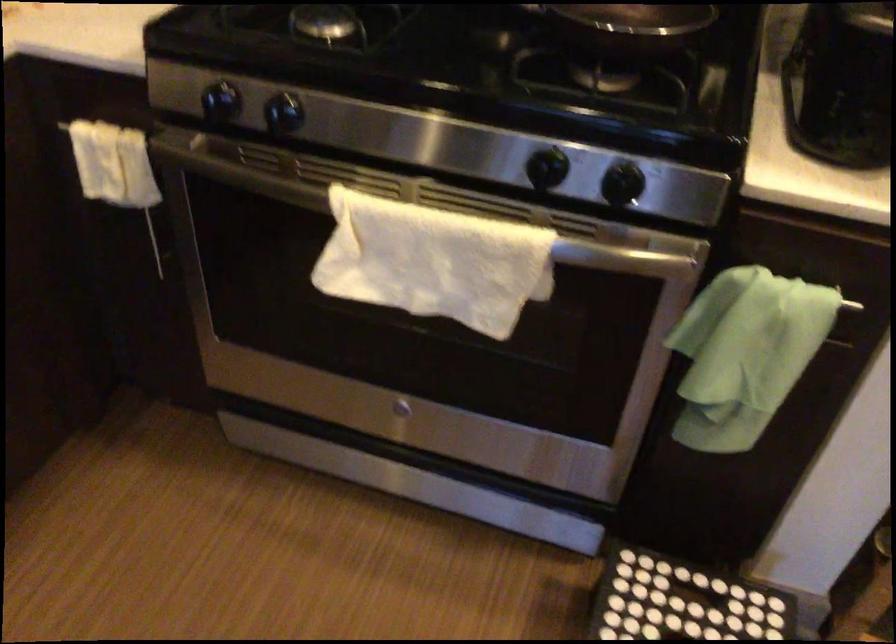
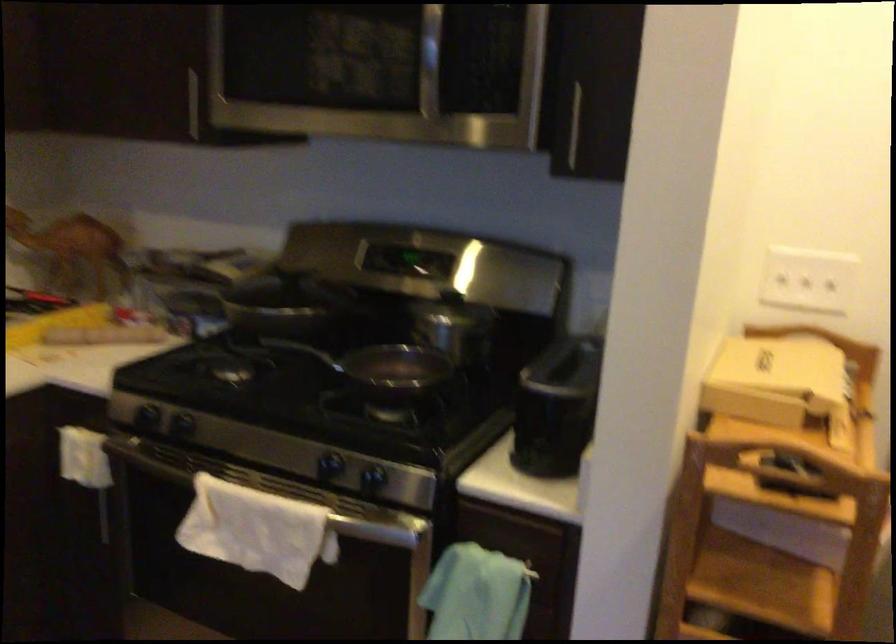
Question: How did the camera likely rotate?

Choices:
 (A) Left
 (B) Right
 (C) Up
 (D) Down

Answer: (C)